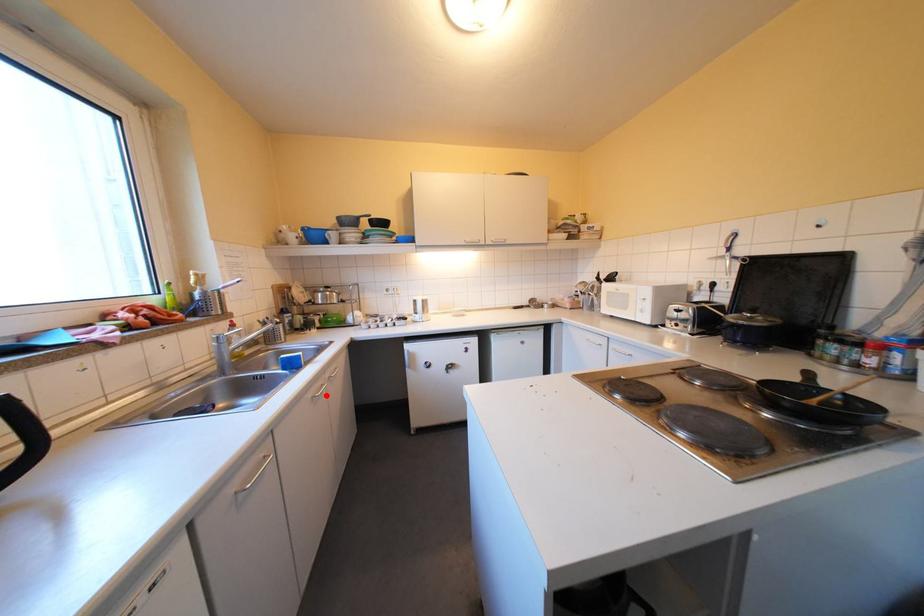
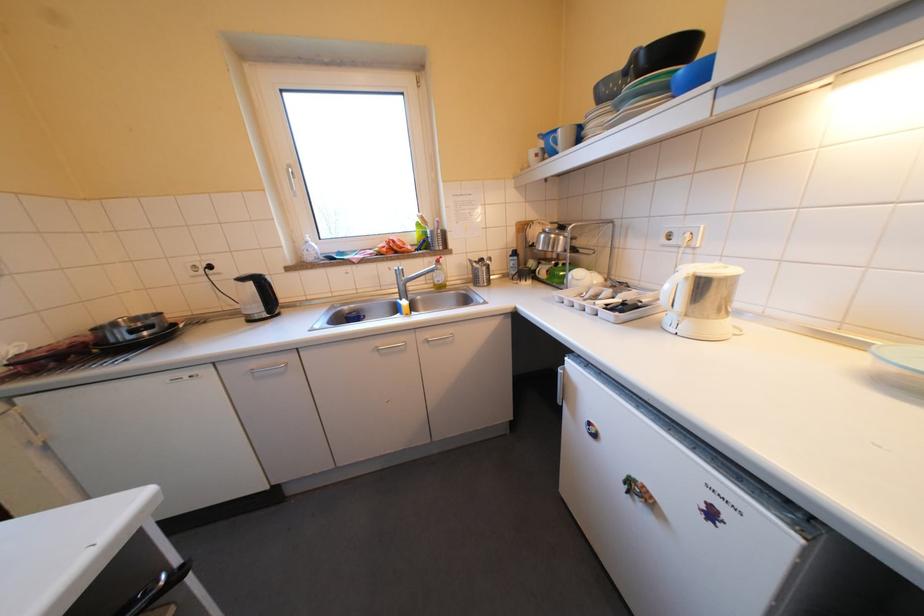
Question: A red point is marked in image1. In image2, is the corresponding 3D point closer to the camera or farther? Reply with the corresponding letter.

Choices:
 (A) The corresponding 3D point is closer.
 (B) The corresponding 3D point is farther.

Answer: (B)